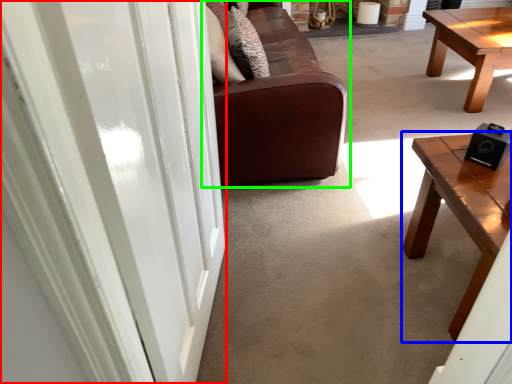
Question: Which is nearer to the screen door (highlighted by a red box)? coffee table (highlighted by a blue box) or studio couch (highlighted by a green box).

Choices:
 (A) coffee table
 (B) studio couch

Answer: (A)